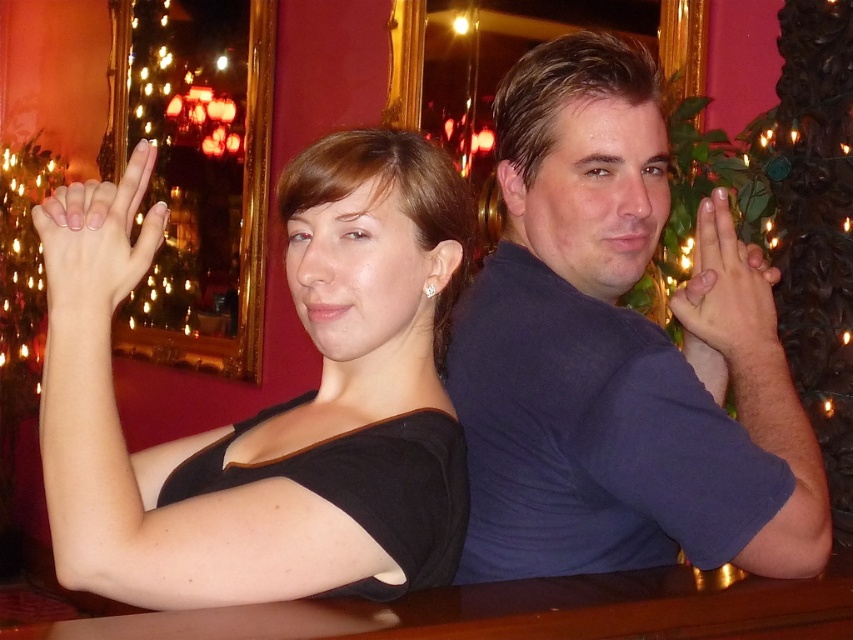
Question: Does dark blue shirt at center appear on the left side of matte black top at left?

Choices:
 (A) no
 (B) yes

Answer: (A)

Question: Which of the following is the closest to the observer?

Choices:
 (A) white polished nails at upper left
 (B) smooth skin hand at upper right

Answer: (A)

Question: Does dark blue shirt at center appear on the left side of smooth skin hand at upper right?

Choices:
 (A) yes
 (B) no

Answer: (A)

Question: Which object appears farthest from the camera in this image?

Choices:
 (A) white polished nails at upper left
 (B) matte black top at left
 (C) smooth skin hand at upper right

Answer: (C)

Question: Which of these objects is positioned farthest from the smooth skin hand at upper right?

Choices:
 (A) dark blue shirt at center
 (B) matte black top at left
 (C) white polished nails at upper left

Answer: (C)

Question: In this image, where is dark blue shirt at center located relative to smooth skin hand at upper right?

Choices:
 (A) above
 (B) below

Answer: (B)